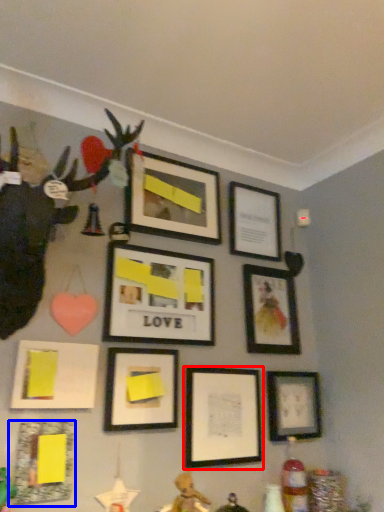
Question: Which object is closer to the camera taking this photo, picture frame (highlighted by a red box) or picture frame (highlighted by a blue box)?

Choices:
 (A) picture frame
 (B) picture frame

Answer: (B)